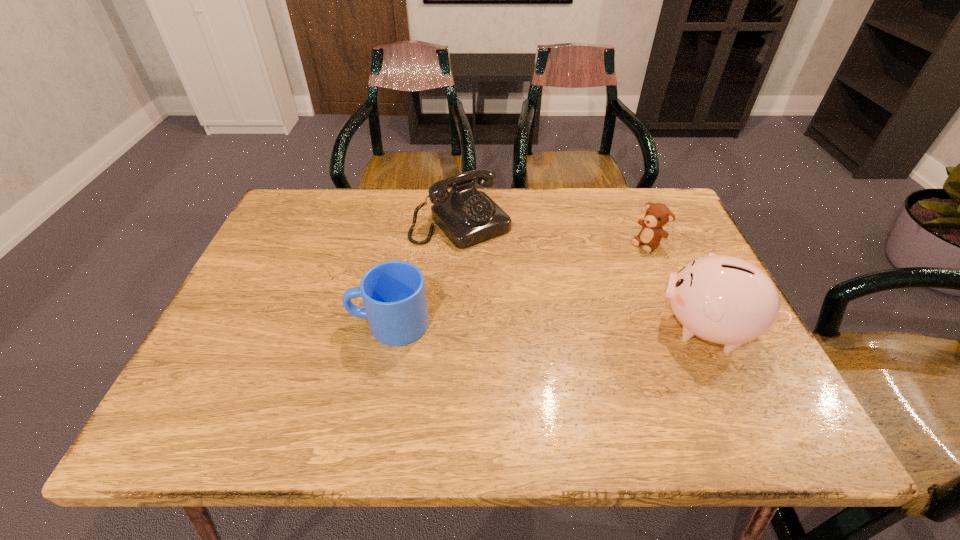
Find the location of a particular element. Image resolution: width=960 pixels, height=540 pixels. object at the near right corner is located at coordinates (723, 299).

Where is `vacant space at the far edge of the desktop`? The height and width of the screenshot is (540, 960). vacant space at the far edge of the desktop is located at coordinates (386, 214).

At what (x,y) coordinates should I click in order to perform the action: click on free space at the near edge. Please return your answer as a coordinate pair (x, y). Looking at the image, I should click on (455, 365).

You are a GUI agent. You are given a task and a screenshot of the screen. Output one action in this format:
    pyautogui.click(x=<x>, y=<y>)
    Task: Click on the vacant region at the left edge of the desktop
    The height and width of the screenshot is (540, 960).
    Given the screenshot: What is the action you would take?
    pyautogui.click(x=289, y=309)

Where is `blank region between the telephone and the piggy bank`? blank region between the telephone and the piggy bank is located at coordinates click(x=584, y=275).

I want to click on vacant area between the mug and the teddy bear, so click(x=517, y=284).

Where is `blank region between the mug and the teddy bear`? This screenshot has width=960, height=540. blank region between the mug and the teddy bear is located at coordinates (517, 284).

Locate an element on the screen. vacant point located between the telephone and the teddy bear is located at coordinates (554, 233).

At what (x,y) coordinates should I click in order to perform the action: click on unoccupied area between the mug and the telephone. Please return your answer as a coordinate pair (x, y). This screenshot has height=540, width=960. Looking at the image, I should click on (424, 273).

You are a GUI agent. You are given a task and a screenshot of the screen. Output one action in this format:
    pyautogui.click(x=<x>, y=<y>)
    Task: Click on the vacant area that lies between the mug and the tallest object
    The width and height of the screenshot is (960, 540).
    Given the screenshot: What is the action you would take?
    pyautogui.click(x=548, y=326)